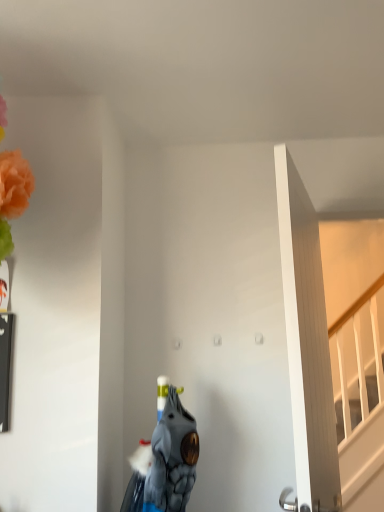
Question: From the image's perspective, is white wooden door at right under blue fabric animal at center?

Choices:
 (A) no
 (B) yes

Answer: (A)

Question: Is white wooden door at right positioned in front of blue fabric animal at center?

Choices:
 (A) yes
 (B) no

Answer: (A)

Question: From a real-world perspective, is white wooden door at right positioned under blue fabric animal at center based on gravity?

Choices:
 (A) yes
 (B) no

Answer: (B)

Question: Is white wooden door at right thinner than blue fabric animal at center?

Choices:
 (A) yes
 (B) no

Answer: (A)

Question: Does white wooden door at right have a smaller size compared to blue fabric animal at center?

Choices:
 (A) no
 (B) yes

Answer: (A)

Question: Is white wooden door at right completely or partially outside of blue fabric animal at center?

Choices:
 (A) no
 (B) yes

Answer: (B)

Question: Is there a large distance between blue fabric animal at center and white wooden door at right?

Choices:
 (A) no
 (B) yes

Answer: (A)

Question: Considering the relative sizes of blue fabric animal at center and white wooden door at right in the image provided, is blue fabric animal at center smaller than white wooden door at right?

Choices:
 (A) yes
 (B) no

Answer: (A)

Question: From the image's perspective, does blue fabric animal at center appear higher than white wooden door at right?

Choices:
 (A) yes
 (B) no

Answer: (B)

Question: From a real-world perspective, is blue fabric animal at center positioned over white wooden door at right based on gravity?

Choices:
 (A) no
 (B) yes

Answer: (A)

Question: Is blue fabric animal at center bigger than white wooden door at right?

Choices:
 (A) yes
 (B) no

Answer: (B)

Question: Is blue fabric animal at center in contact with white wooden door at right?

Choices:
 (A) yes
 (B) no

Answer: (B)

Question: Is blue fabric animal at center taller or shorter than white wooden door at right?

Choices:
 (A) short
 (B) tall

Answer: (A)